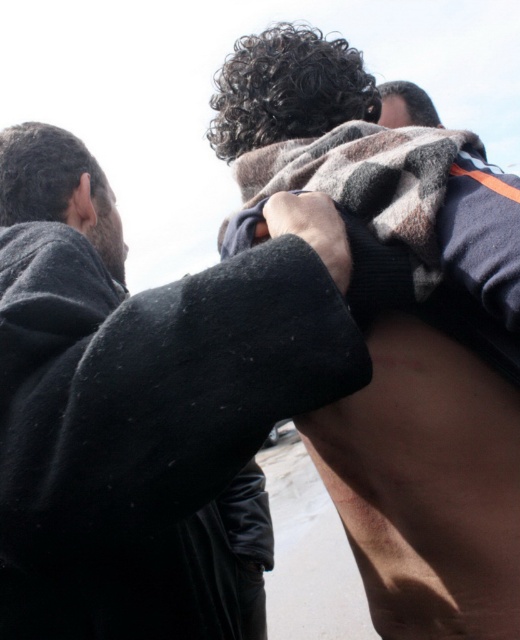
Is dark gray wool sweater at upper center positioned behind fuzzy wool blanket at upper center?

No, it is in front of fuzzy wool blanket at upper center.

From the picture: Can you confirm if dark gray wool sweater at upper center is smaller than fuzzy wool blanket at upper center?

Actually, dark gray wool sweater at upper center might be larger than fuzzy wool blanket at upper center.

This screenshot has height=640, width=520. What do you see at coordinates (140, 406) in the screenshot?
I see `dark gray wool sweater at upper center` at bounding box center [140, 406].

Locate an element on the screen. dark gray wool sweater at upper center is located at coordinates (140, 406).